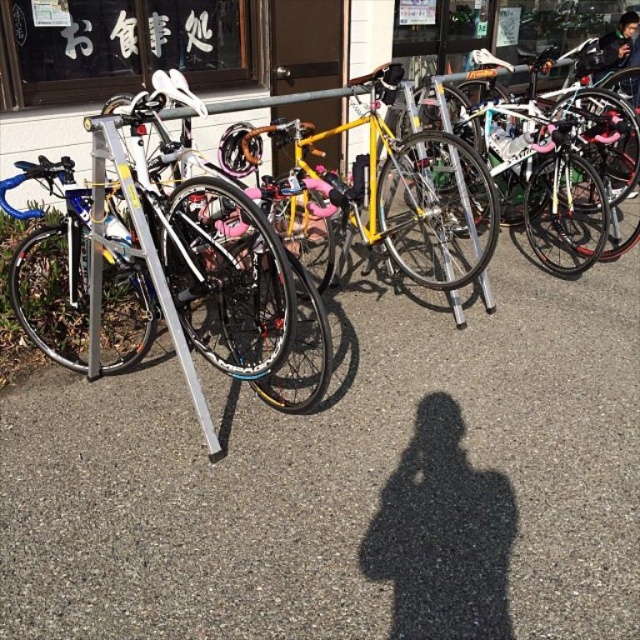
Image resolution: width=640 pixels, height=640 pixels. What do you see at coordinates (80, 308) in the screenshot?
I see `shiny silver bicycle at center` at bounding box center [80, 308].

Locate an element on the screen. The height and width of the screenshot is (640, 640). shiny silver bicycle at center is located at coordinates (80, 308).

Is matte asphalt pavement at center positioned before yellow matte bicycle at center?

Yes, it is.

Consider the image. Is matte asphalt pavement at center above yellow matte bicycle at center?

No.

This screenshot has height=640, width=640. Identify the location of matte asphalt pavement at center. (348, 481).

This screenshot has width=640, height=640. Describe the element at coordinates (348, 481) in the screenshot. I see `matte asphalt pavement at center` at that location.

Is point (636, 332) behind point (496, 205)?

Yes, it is.

Between point (164, 625) and point (330, 339), which one is positioned in front?

Positioned in front is point (164, 625).

What are the coordinates of `matte asphalt pavement at center` in the screenshot? It's located at (348, 481).